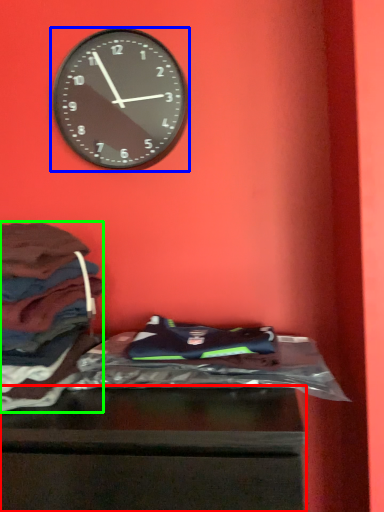
Question: Estimate the real-world distances between objects in this image. Which object is closer to furniture (highlighted by a red box), wall clock (highlighted by a blue box) or clothing (highlighted by a green box)?

Choices:
 (A) wall clock
 (B) clothing

Answer: (B)